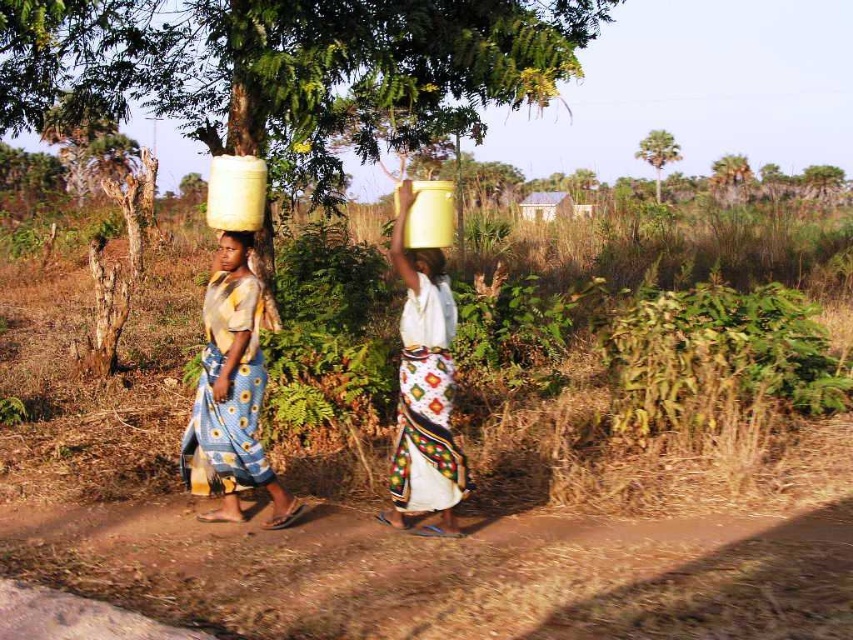
You are a photographer trying to capture the yellow matte water bucket at upper center in the image. The camera is set to focus at point coordinates of 0.620, 0.497. Will the bucket be in focus?

The yellow matte water bucket at upper center is positioned exactly at point coordinates of (x=422, y=396), so the bucket will be in focus.

You are a photographer taking a picture of the two women walking along the dirt path. You notice the blue printed fabric skirt at left and the smooth skin face at center. Which object is positioned lower in the image?

The blue printed fabric skirt at left is located below the smooth skin face at center, so it is positioned lower in the image.